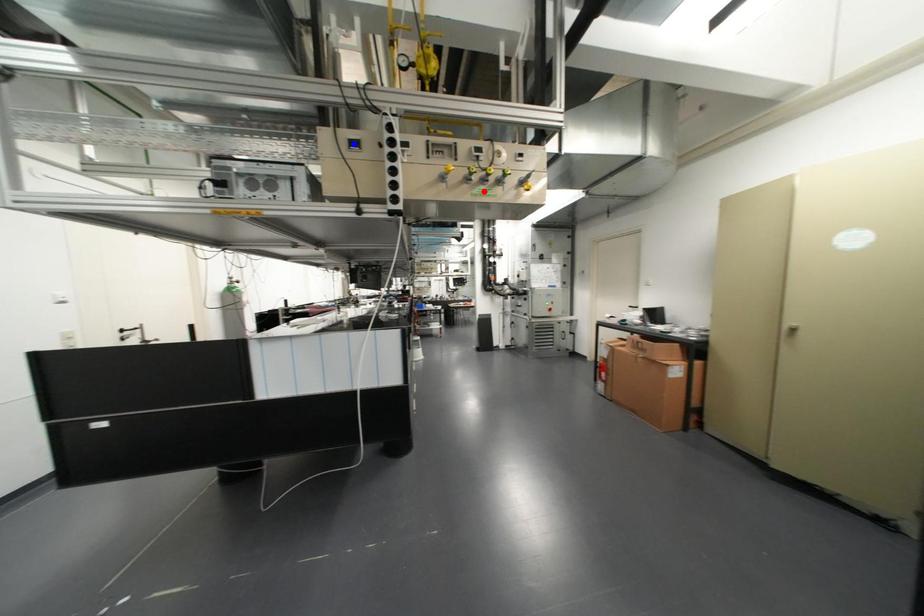
Question: Two points are marked on the image. Which point is closer to the camera?

Choices:
 (A) Blue point is closer.
 (B) Red point is closer.

Answer: (A)